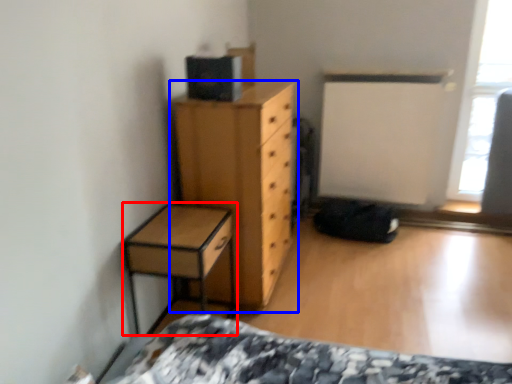
Question: Which object appears farthest to the camera in this image, nightstand (highlighted by a red box) or chest of drawers (highlighted by a blue box)?

Choices:
 (A) nightstand
 (B) chest of drawers

Answer: (B)